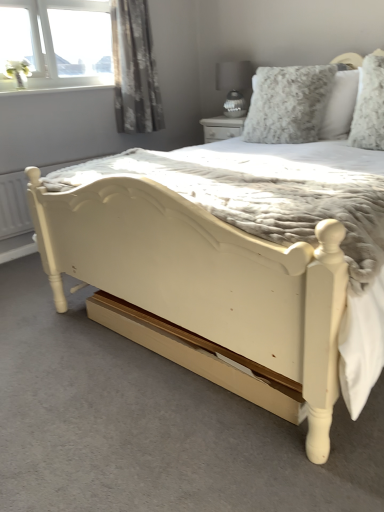
Question: Is fluffy white pillow at upper right, positioned as the first pillow in right-to-left order, turned away from floral gray curtain at upper left?

Choices:
 (A) no
 (B) yes

Answer: (A)

Question: Is fluffy white pillow at upper right, placed as the second pillow when sorted from left to right, outside of floral gray curtain at upper left?

Choices:
 (A) yes
 (B) no

Answer: (A)

Question: Is fluffy white pillow at upper right, placed as the second pillow when sorted from left to right, far from floral gray curtain at upper left?

Choices:
 (A) yes
 (B) no

Answer: (A)

Question: From a real-world perspective, is fluffy white pillow at upper right, positioned as the first pillow in right-to-left order, on floral gray curtain at upper left?

Choices:
 (A) no
 (B) yes

Answer: (A)

Question: Does fluffy white pillow at upper right, positioned as the first pillow in right-to-left order, appear on the left side of floral gray curtain at upper left?

Choices:
 (A) no
 (B) yes

Answer: (A)

Question: Considering the positions of fluffy white pillow at upper right, placed as the second pillow when sorted from left to right, and floral gray curtain at upper left in the image, is fluffy white pillow at upper right, placed as the second pillow when sorted from left to right, taller or shorter than floral gray curtain at upper left?

Choices:
 (A) short
 (B) tall

Answer: (A)

Question: Considering their positions, is fluffy white pillow at upper right, placed as the second pillow when sorted from left to right, located in front of or behind floral gray curtain at upper left?

Choices:
 (A) behind
 (B) front

Answer: (B)

Question: Is fluffy white pillow at upper right, positioned as the first pillow in right-to-left order, inside or outside of floral gray curtain at upper left?

Choices:
 (A) inside
 (B) outside

Answer: (B)

Question: In terms of width, does fluffy white pillow at upper right, positioned as the first pillow in right-to-left order, look wider or thinner when compared to floral gray curtain at upper left?

Choices:
 (A) thin
 (B) wide

Answer: (A)

Question: In terms of height, does matte gray glass lamp at upper center look taller or shorter compared to floral gray curtain at upper left?

Choices:
 (A) short
 (B) tall

Answer: (A)

Question: From the image's perspective, is matte gray glass lamp at upper center above or below floral gray curtain at upper left?

Choices:
 (A) above
 (B) below

Answer: (B)

Question: Choose the correct answer: Is matte gray glass lamp at upper center inside floral gray curtain at upper left or outside it?

Choices:
 (A) inside
 (B) outside

Answer: (B)

Question: Looking at their shapes, would you say matte gray glass lamp at upper center is wider or thinner than floral gray curtain at upper left?

Choices:
 (A) thin
 (B) wide

Answer: (B)

Question: From the image's perspective, is floral gray curtain at upper left above or below fluffy white pillow at upper right, placed as the second pillow when sorted from left to right?

Choices:
 (A) above
 (B) below

Answer: (A)

Question: Considering the relative positions of floral gray curtain at upper left and fluffy white pillow at upper right, placed as the second pillow when sorted from left to right, in the image provided, is floral gray curtain at upper left to the left or to the right of fluffy white pillow at upper right, placed as the second pillow when sorted from left to right,?

Choices:
 (A) left
 (B) right

Answer: (A)